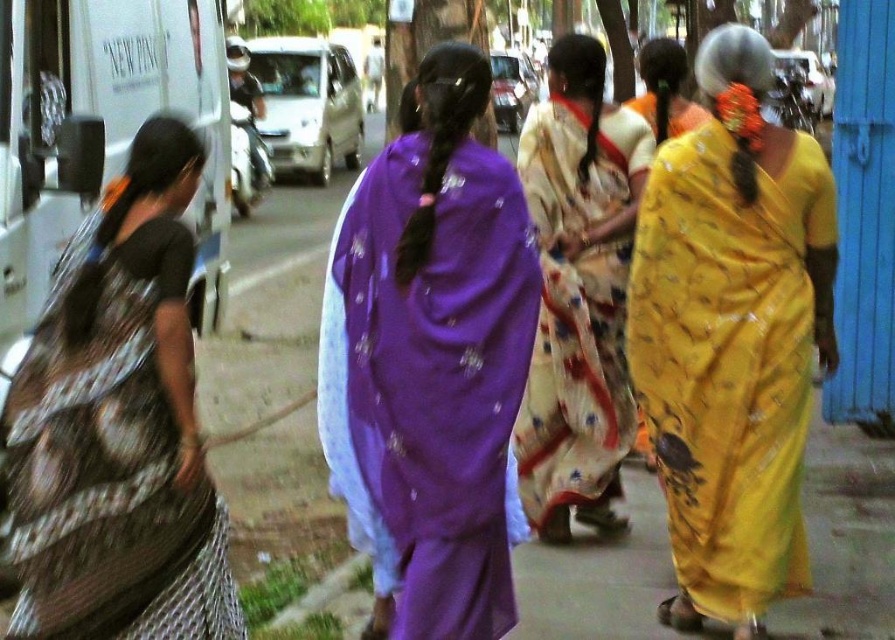
Question: Is the position of purple satin saree at center more distant than that of printed fabric saree at left?

Choices:
 (A) yes
 (B) no

Answer: (A)

Question: Which object is the closest to the printed silk sari at center?

Choices:
 (A) printed fabric saree at left
 (B) yellow satin saree at center
 (C) yellow satin saree at right
 (D) purple satin saree at center

Answer: (C)

Question: Which of the following is the closest to the observer?

Choices:
 (A) purple satin saree at center
 (B) yellow satin saree at right
 (C) printed silk sari at center

Answer: (A)

Question: Which point is farther from the camera taking this photo?

Choices:
 (A) click(135, 577)
 (B) click(533, 248)
 (C) click(661, 136)
 (D) click(593, 161)

Answer: (C)

Question: Does printed fabric saree at left lie in front of printed silk sari at center?

Choices:
 (A) no
 (B) yes

Answer: (B)

Question: Can you confirm if purple satin saree at center is positioned to the left of yellow satin saree at right?

Choices:
 (A) no
 (B) yes

Answer: (B)